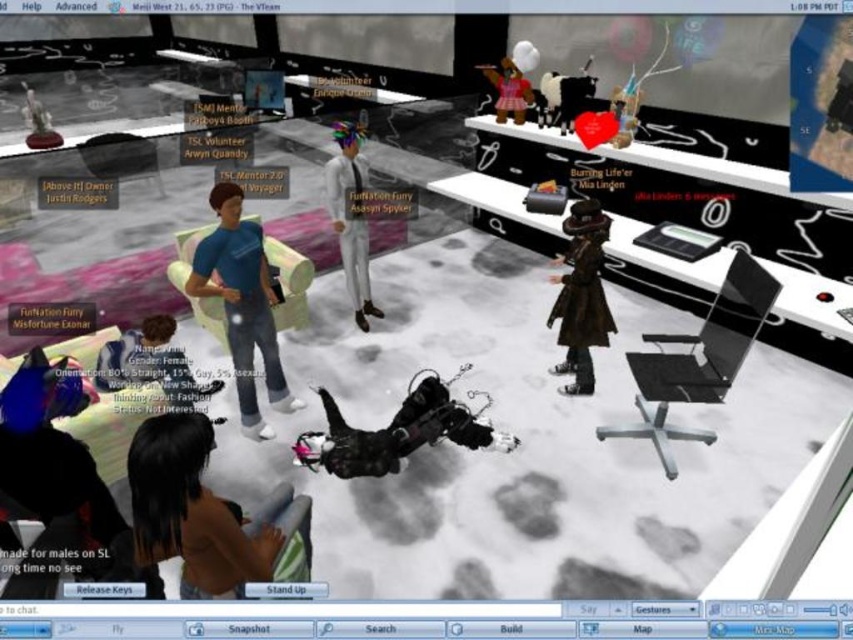
Question: Is brown leather coat at right closer to camera compared to pink satin dress at upper center?

Choices:
 (A) yes
 (B) no

Answer: (A)

Question: Among these points, which one is farthest from the camera?

Choices:
 (A) (223, 524)
 (B) (96, 374)

Answer: (B)

Question: Which object is positioned closest to the white matte/soft fur at center?

Choices:
 (A) matte black outfit at lower left
 (B) blue jeans at center

Answer: (B)

Question: Which of the following is the farthest from the observer?

Choices:
 (A) (270, 328)
 (B) (524, 116)
 (C) (190, 554)

Answer: (B)

Question: Can you confirm if brown matte hair at lower left is positioned above white matte/soft fur at center?

Choices:
 (A) yes
 (B) no

Answer: (B)

Question: Is brown matte hair at lower left bigger than white matte/soft fur at center?

Choices:
 (A) no
 (B) yes

Answer: (A)